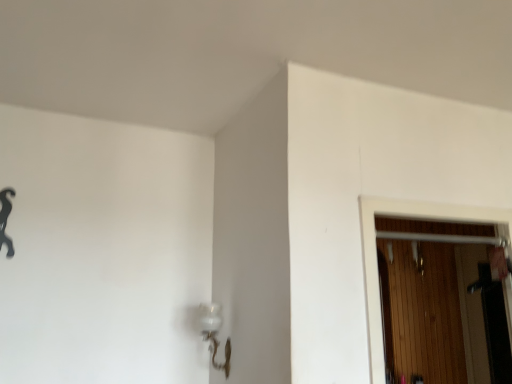
Question: Does clear glass lamp at lower center contain wooden at right?

Choices:
 (A) no
 (B) yes

Answer: (A)

Question: From a real-world perspective, is clear glass lamp at lower center located higher than wooden at right?

Choices:
 (A) no
 (B) yes

Answer: (A)

Question: From the image's perspective, is clear glass lamp at lower center located above wooden at right?

Choices:
 (A) yes
 (B) no

Answer: (B)

Question: Is clear glass lamp at lower center aimed at wooden at right?

Choices:
 (A) yes
 (B) no

Answer: (B)

Question: Is clear glass lamp at lower center at the left side of wooden at right?

Choices:
 (A) no
 (B) yes

Answer: (B)

Question: Considering their positions, is black matte hook at upper left located in front of or behind wooden at right?

Choices:
 (A) front
 (B) behind

Answer: (B)

Question: Do you think black matte hook at upper left is within wooden at right, or outside of it?

Choices:
 (A) inside
 (B) outside

Answer: (B)

Question: From a real-world perspective, is black matte hook at upper left positioned above or below wooden at right?

Choices:
 (A) above
 (B) below

Answer: (A)

Question: Is point (0, 193) closer or farther from the camera than point (467, 230)?

Choices:
 (A) closer
 (B) farther

Answer: (A)

Question: From their relative heights in the image, would you say wooden at right is taller or shorter than black matte hook at upper left?

Choices:
 (A) short
 (B) tall

Answer: (B)

Question: Considering the positions of wooden at right and black matte hook at upper left in the image, is wooden at right wider or thinner than black matte hook at upper left?

Choices:
 (A) wide
 (B) thin

Answer: (A)

Question: From the image's perspective, is wooden at right positioned above or below black matte hook at upper left?

Choices:
 (A) below
 (B) above

Answer: (A)

Question: Is wooden at right bigger or smaller than black matte hook at upper left?

Choices:
 (A) small
 (B) big

Answer: (B)

Question: Is wooden at right taller or shorter than clear glass lamp at lower center?

Choices:
 (A) short
 (B) tall

Answer: (B)

Question: From the image's perspective, is wooden at right located above or below clear glass lamp at lower center?

Choices:
 (A) above
 (B) below

Answer: (A)